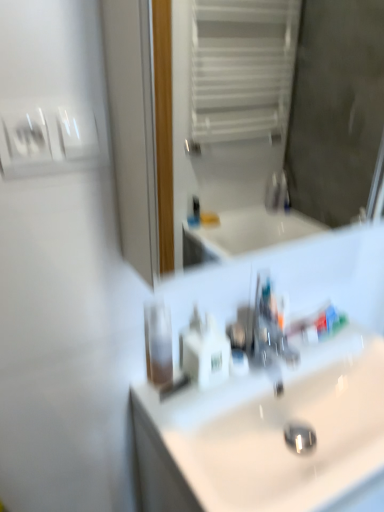
Question: Can you confirm if white glossy toothpaste at center is shorter than white plastic soap dispenser at center?

Choices:
 (A) no
 (B) yes

Answer: (B)

Question: Does white glossy toothpaste at center have a greater height compared to white plastic soap dispenser at center?

Choices:
 (A) no
 (B) yes

Answer: (A)

Question: Is white glossy toothpaste at center wider than white plastic soap dispenser at center?

Choices:
 (A) no
 (B) yes

Answer: (A)

Question: Does white glossy toothpaste at center appear on the right side of white plastic soap dispenser at center?

Choices:
 (A) yes
 (B) no

Answer: (A)

Question: From the image's perspective, is white glossy toothpaste at center under white plastic soap dispenser at center?

Choices:
 (A) yes
 (B) no

Answer: (B)

Question: Can you confirm if white glossy toothpaste at center is positioned to the left of white plastic soap dispenser at center?

Choices:
 (A) no
 (B) yes

Answer: (A)

Question: From the image's perspective, is white glossy toothpaste at center below white glossy mirror at upper center?

Choices:
 (A) yes
 (B) no

Answer: (A)

Question: From the image's perspective, is white glossy toothpaste at center on top of white glossy mirror at upper center?

Choices:
 (A) no
 (B) yes

Answer: (A)

Question: Can you confirm if white glossy toothpaste at center is taller than white glossy mirror at upper center?

Choices:
 (A) no
 (B) yes

Answer: (A)

Question: Considering the relative sizes of white glossy toothpaste at center and white glossy mirror at upper center in the image provided, is white glossy toothpaste at center wider than white glossy mirror at upper center?

Choices:
 (A) yes
 (B) no

Answer: (B)

Question: Is white glossy toothpaste at center outside white glossy mirror at upper center?

Choices:
 (A) yes
 (B) no

Answer: (A)

Question: Is white glossy toothpaste at center bigger than white glossy mirror at upper center?

Choices:
 (A) no
 (B) yes

Answer: (A)

Question: Can you confirm if white glossy toothpaste at center is positioned to the left of white glossy light switch at upper left?

Choices:
 (A) no
 (B) yes

Answer: (A)